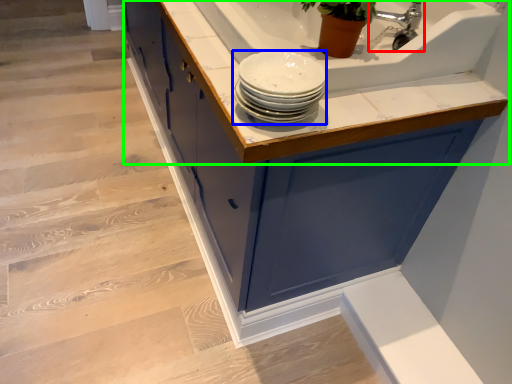
Question: Based on their relative distances, which object is farther from tap (highlighted by a red box)? Choose from tableware (highlighted by a blue box) and countertop (highlighted by a green box).

Choices:
 (A) tableware
 (B) countertop

Answer: (A)